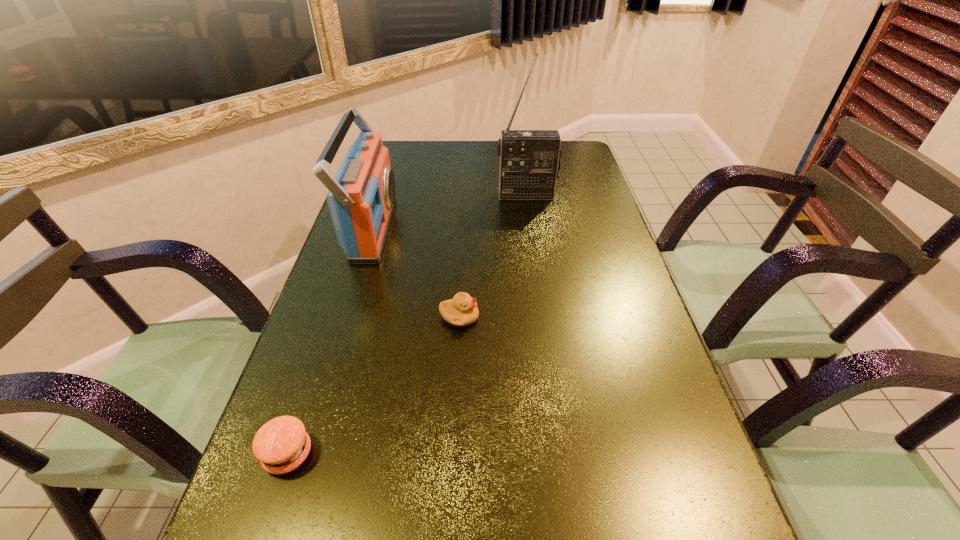
At what (x,y) coordinates should I click in order to perform the action: click on the right radio receiver. Please return your answer as a coordinate pair (x, y). Image resolution: width=960 pixels, height=540 pixels. Looking at the image, I should click on (530, 161).

At what (x,y) coordinates should I click in order to perform the action: click on the tallest object. Please return your answer as a coordinate pair (x, y). Looking at the image, I should click on (530, 161).

Where is `the second tallest object`? the second tallest object is located at coordinates (361, 197).

Locate an element on the screen. This screenshot has width=960, height=540. the shorter radio receiver is located at coordinates (361, 197).

Find the location of `the second object from right to left`. the second object from right to left is located at coordinates (462, 310).

Find the location of `duckling`. duckling is located at coordinates (462, 310).

At what (x,y) coordinates should I click in order to perform the action: click on the nearest object. Please return your answer as a coordinate pair (x, y). This screenshot has width=960, height=540. Looking at the image, I should click on (281, 445).

At what (x,y) coordinates should I click in order to perform the action: click on vacant space located on the display of the taller radio receiver. Please return your answer as a coordinate pair (x, y). This screenshot has height=540, width=960. Looking at the image, I should click on (531, 221).

The height and width of the screenshot is (540, 960). What are the coordinates of `free spot located 0.350m on the front-facing side of the third shortest object` in the screenshot? It's located at (519, 229).

Locate an element on the screen. This screenshot has height=540, width=960. free location located 0.130m on the front-facing side of the third farthest object is located at coordinates (538, 317).